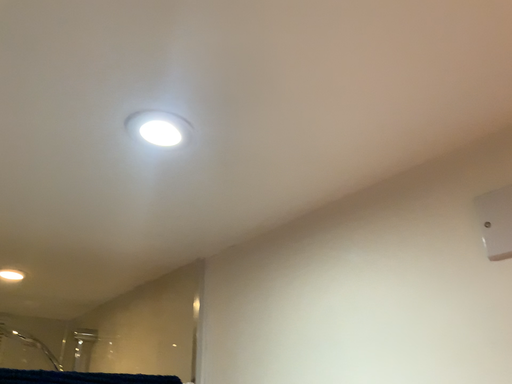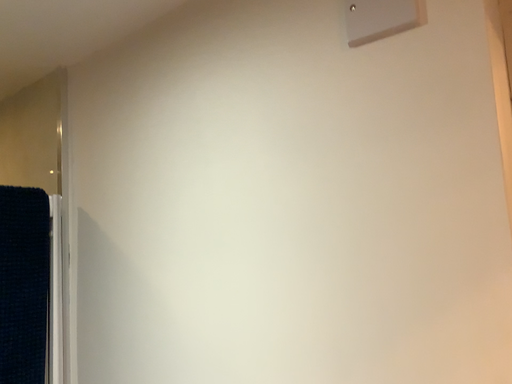
Question: Which way did the camera rotate in the video?

Choices:
 (A) rotated right
 (B) rotated left

Answer: (A)